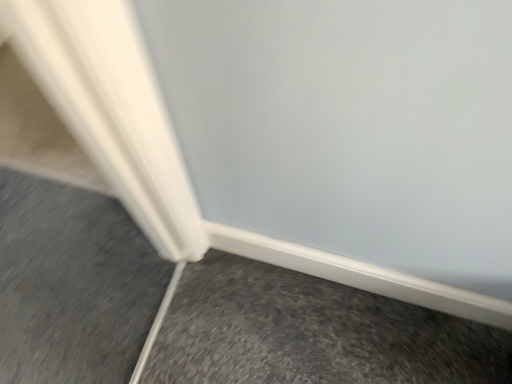
What is the approximate height of white smooth baseboard at lower center?

It is 1.79 inches.

What do you see at coordinates (312, 333) in the screenshot? Image resolution: width=512 pixels, height=384 pixels. I see `white smooth baseboard at lower center` at bounding box center [312, 333].

Locate an element on the screen. This screenshot has width=512, height=384. white smooth baseboard at lower center is located at coordinates (312, 333).

The height and width of the screenshot is (384, 512). I want to click on white smooth baseboard at lower center, so click(x=312, y=333).